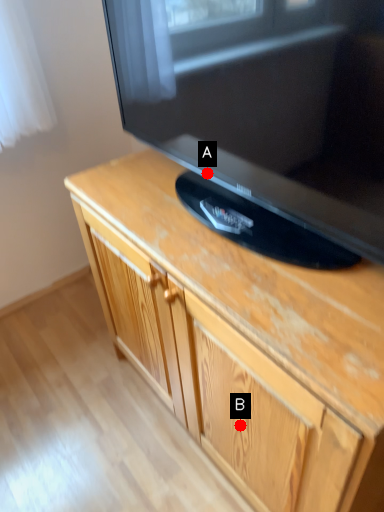
Question: Two points are circled on the image, labeled by A and B beside each circle. Which of the following is the farthest from the observer?

Choices:
 (A) A is further
 (B) B is further

Answer: (A)